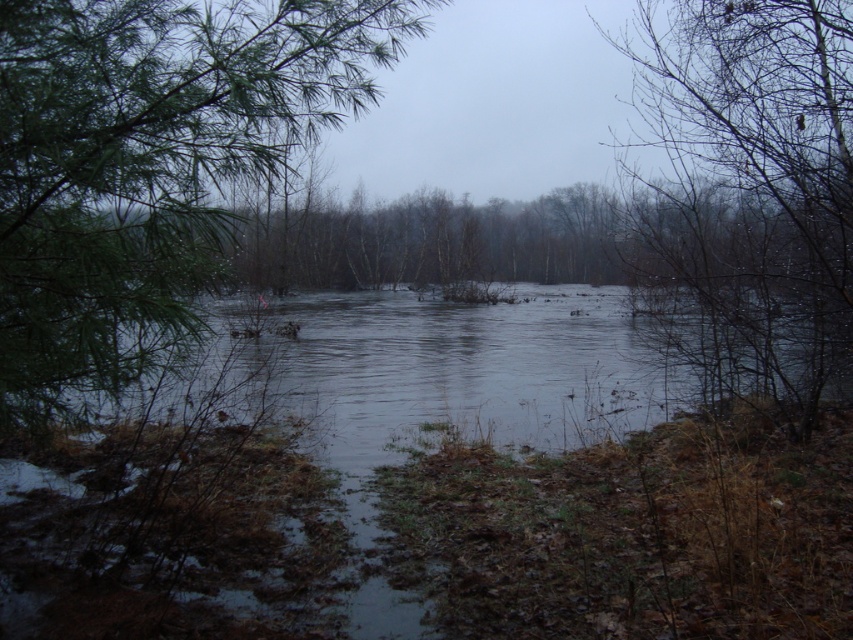
Question: Can you confirm if dark gray water at center is positioned to the right of bare branches at center?

Choices:
 (A) no
 (B) yes

Answer: (A)

Question: Does green needle-like leaves at left lie behind bare branches at center?

Choices:
 (A) yes
 (B) no

Answer: (B)

Question: Can you confirm if dark gray water at center is positioned to the right of bare branches at center?

Choices:
 (A) yes
 (B) no

Answer: (B)

Question: Which point appears farthest from the camera in this image?

Choices:
 (A) (750, 216)
 (B) (256, 440)

Answer: (A)

Question: Which object is closer to the camera taking this photo?

Choices:
 (A) bare branches at center
 (B) dark gray water at center

Answer: (B)

Question: Which of the following is the farthest from the observer?

Choices:
 (A) green needle-like leaves at left
 (B) bare branches at center

Answer: (B)